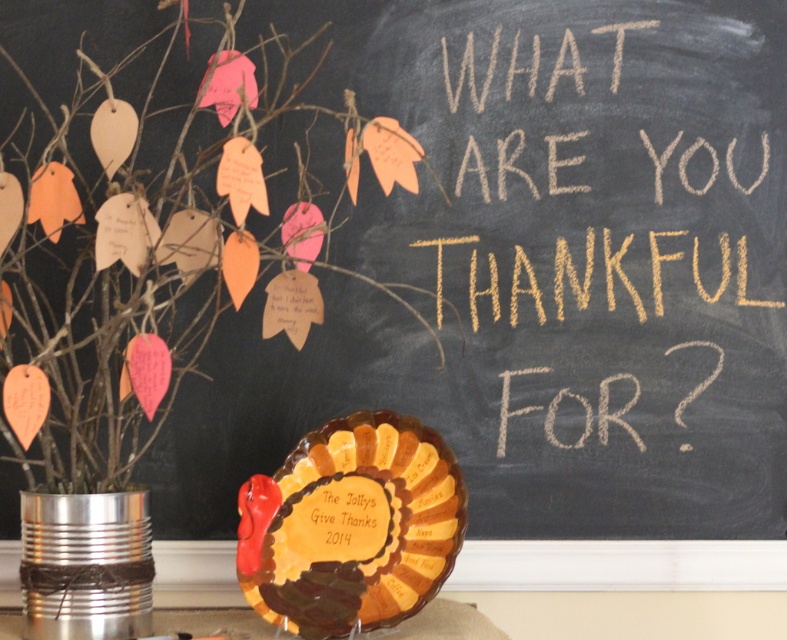
You are setting up a Thanksgiving display and need to stack items vertically. You have the brown glossy turkey plate at center and the metallic tin can at lower left. Which item should you place at the bottom to ensure stability?

The metallic tin can at lower left should be placed at the bottom because it is thicker than the brown glossy turkey plate at center, providing a more stable base.